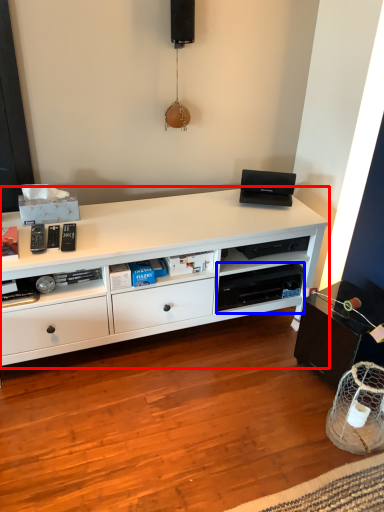
Question: Which of the following is the closest to the observer, desk (highlighted by a red box) or shelf (highlighted by a blue box)?

Choices:
 (A) desk
 (B) shelf

Answer: (A)